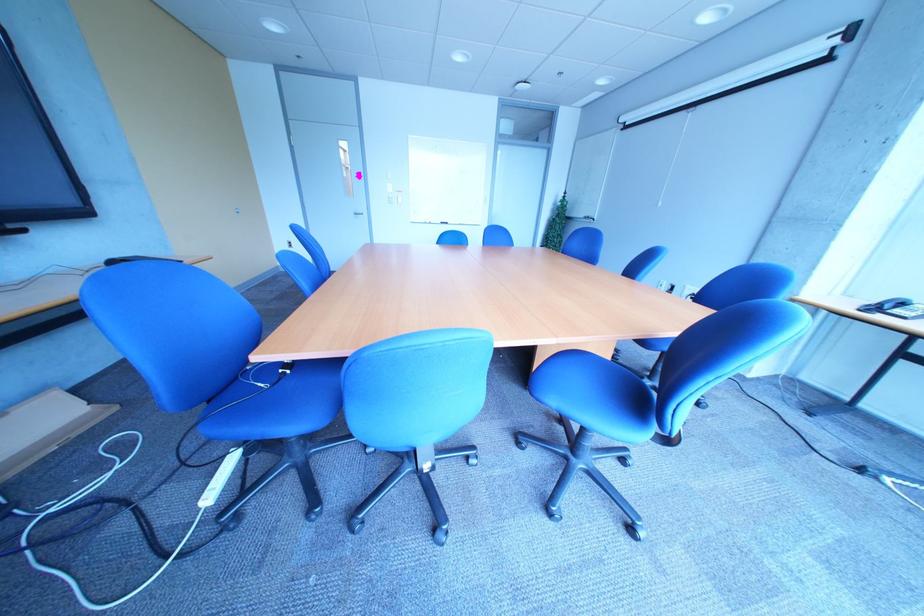
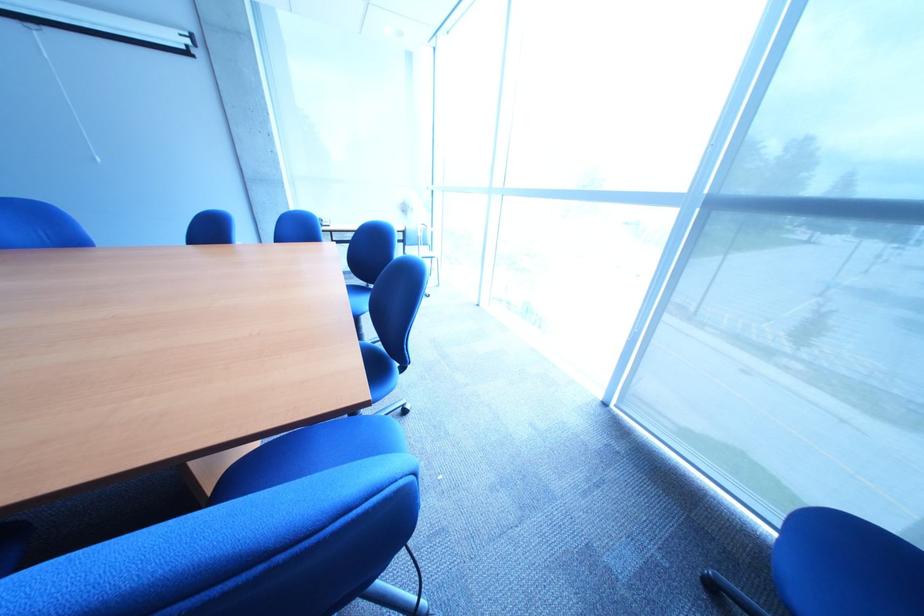
Find the pixel in the second image that matches point 290,514 in the first image.

(419, 567)